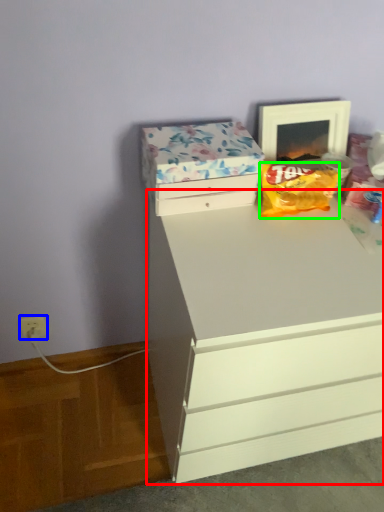
Question: Estimate the real-world distances between objects in this image. Which object is closer to chest of drawers (highlighted by a red box), electric outlet (highlighted by a blue box) or snack (highlighted by a green box)?

Choices:
 (A) electric outlet
 (B) snack

Answer: (B)